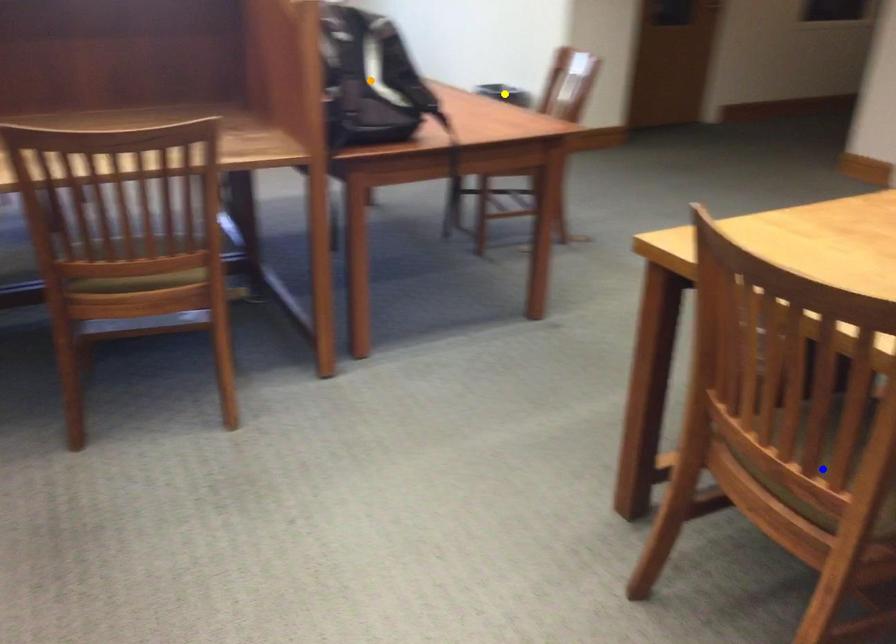
Looking at this image, order these from nearest to farthest:
orange point | blue point | yellow point

blue point → orange point → yellow point